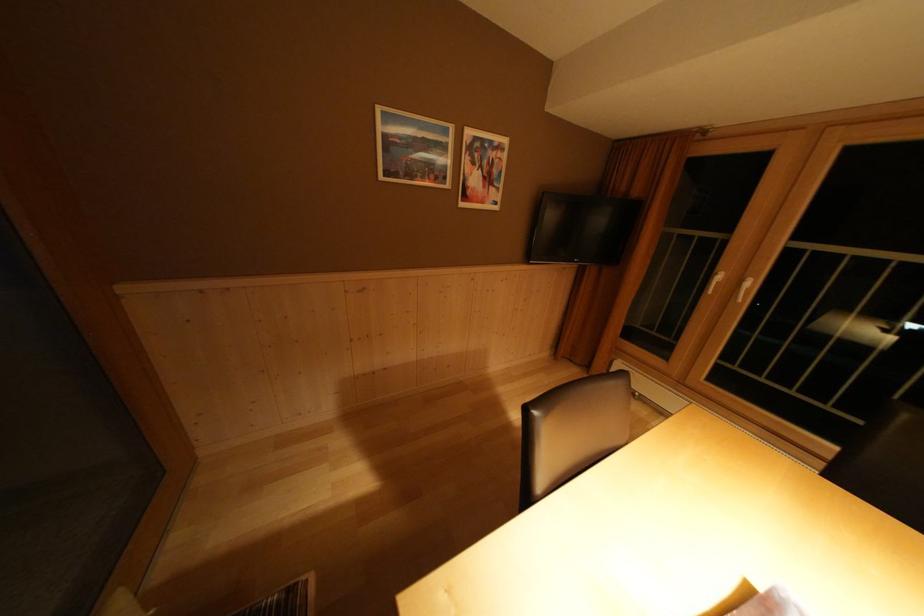
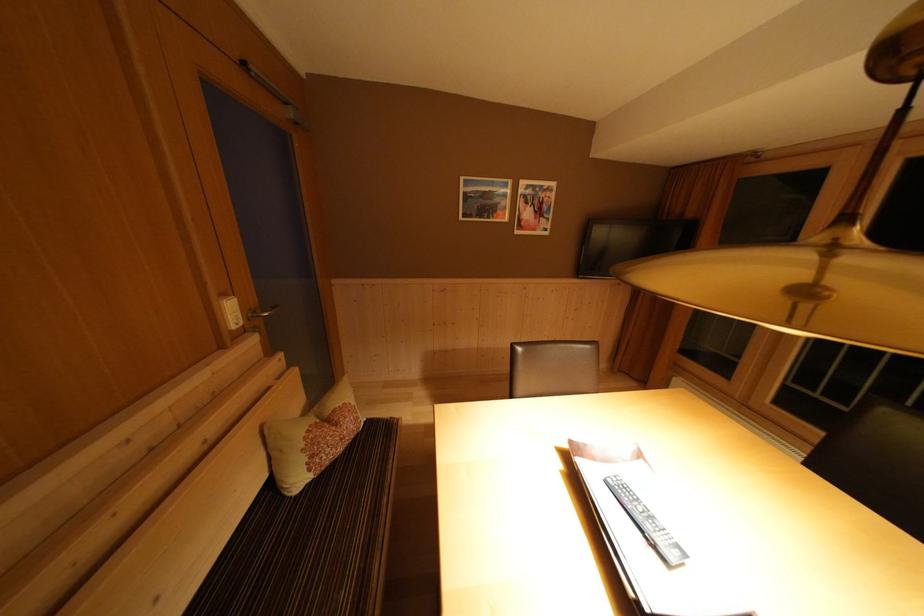
What movement of the cameraman would produce the second image?

The movement direction of the cameraman is right, backward.